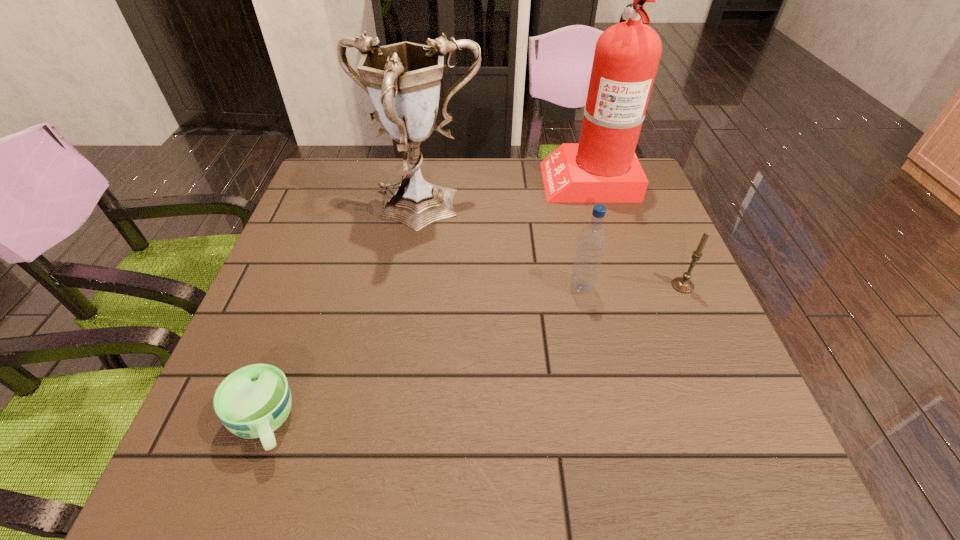
This screenshot has width=960, height=540. I want to click on object present at the far left corner, so click(403, 80).

Locate an element on the screen. This screenshot has width=960, height=540. object that is at the near left corner is located at coordinates (252, 402).

Identify the location of object that is at the far right corner. (602, 168).

Identify the location of free space at the far edge. The width and height of the screenshot is (960, 540). (471, 169).

Find the location of a particular element. The image size is (960, 540). blank space at the near edge of the desktop is located at coordinates (348, 442).

I want to click on vacant space at the left edge of the desktop, so click(336, 213).

This screenshot has height=540, width=960. In the image, there is a desktop. Identify the location of vacant space at the far left corner. (370, 162).

In order to click on free spot at the near right corner of the desktop in this screenshot , I will do `click(692, 465)`.

Identify the location of vacant space that is in between the fire extinguisher and the trophy cup. (504, 195).

In order to click on unoccupied area between the fourth tallest object and the nearest object in this screenshot , I will do `click(473, 354)`.